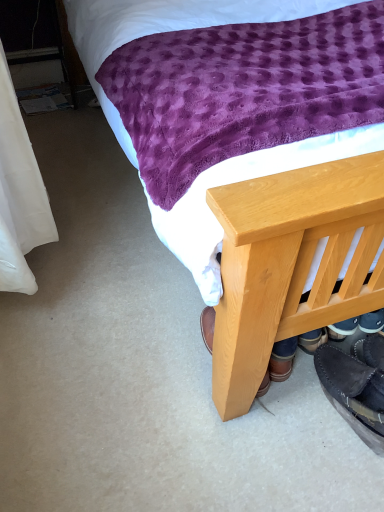
Question: Is black suede shoes at lower right, acting as the 2th footwear starting from the left, positioned before black suede moccasin at lower right, which is the 1th footwear in left-to-right order?

Choices:
 (A) no
 (B) yes

Answer: (B)

Question: From a real-world perspective, is black suede shoes at lower right, which is the 1th footwear in right-to-left order, on top of black suede moccasin at lower right, which is the 1th footwear in left-to-right order?

Choices:
 (A) yes
 (B) no

Answer: (A)

Question: Is black suede shoes at lower right, acting as the 2th footwear starting from the left, surrounding black suede moccasin at lower right, which is the 1th footwear in left-to-right order?

Choices:
 (A) no
 (B) yes

Answer: (A)

Question: Are black suede shoes at lower right, which is the 1th footwear in right-to-left order, and black suede moccasin at lower right, which is the 1th footwear in left-to-right order, beside each other?

Choices:
 (A) no
 (B) yes

Answer: (B)

Question: Is black suede shoes at lower right, acting as the 2th footwear starting from the left, further to camera compared to black suede moccasin at lower right, which is the 1th footwear in left-to-right order?

Choices:
 (A) no
 (B) yes

Answer: (A)

Question: Could you tell me if black suede shoes at lower right, which is the 1th footwear in right-to-left order, is turned towards black suede moccasin at lower right, which is the 1th footwear in left-to-right order?

Choices:
 (A) yes
 (B) no

Answer: (B)

Question: Considering the relative positions of black suede moccasin at lower right, which is the 1th footwear in left-to-right order, and wooden bed frame at lower right in the image provided, is black suede moccasin at lower right, which is the 1th footwear in left-to-right order, to the left of wooden bed frame at lower right from the viewer's perspective?

Choices:
 (A) no
 (B) yes

Answer: (B)

Question: Can you confirm if black suede moccasin at lower right, which appears as the 2th footwear when viewed from the right, is bigger than wooden bed frame at lower right?

Choices:
 (A) no
 (B) yes

Answer: (A)

Question: Is black suede moccasin at lower right, which appears as the 2th footwear when viewed from the right, surrounding wooden bed frame at lower right?

Choices:
 (A) yes
 (B) no

Answer: (B)

Question: Can you confirm if black suede moccasin at lower right, which appears as the 2th footwear when viewed from the right, is thinner than wooden bed frame at lower right?

Choices:
 (A) no
 (B) yes

Answer: (B)

Question: Is black suede moccasin at lower right, which is the 1th footwear in left-to-right order, shorter than wooden bed frame at lower right?

Choices:
 (A) yes
 (B) no

Answer: (A)

Question: From the image's perspective, does black suede moccasin at lower right, which appears as the 2th footwear when viewed from the right, appear lower than wooden bed frame at lower right?

Choices:
 (A) yes
 (B) no

Answer: (A)

Question: Considering the relative sizes of black suede moccasin at lower right, which is the 1th footwear in left-to-right order, and black suede shoes at lower right, which is the 1th footwear in right-to-left order, in the image provided, is black suede moccasin at lower right, which is the 1th footwear in left-to-right order, smaller than black suede shoes at lower right, which is the 1th footwear in right-to-left order,?

Choices:
 (A) yes
 (B) no

Answer: (B)